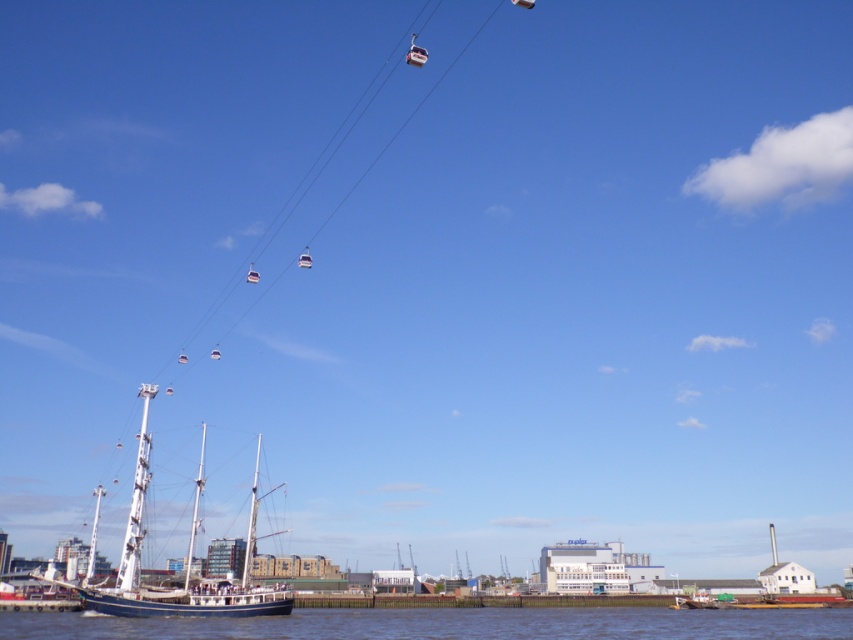
You are a small toy boat that is 1 meter wide. You want to sail from the wooden sailboat at lower left to the blue water at lower center. Is there enough space for you to pass through the area between them?

The blue water at lower center might be wider than the wooden sailboat at lower left, so there is a possibility that the 1 meter wide toy boat can pass through the space between them. However, the exact width isn not specified, so caution is advised.

In the scene shown: You are standing at the point marked as point (x=447, y=624) in the image. What do you see directly below you?

You see blue water at lower center directly below the point (x=447, y=624).